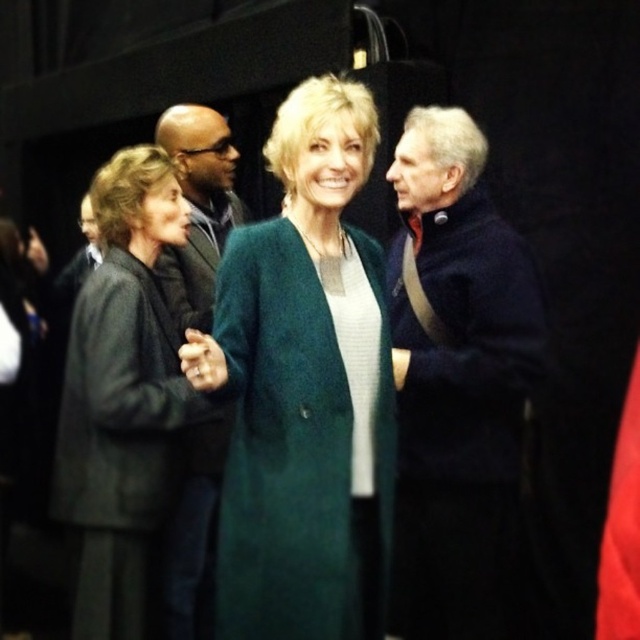
Question: Does green wool coat at center appear over matte black coat at center?

Choices:
 (A) yes
 (B) no

Answer: (B)

Question: Does dark blue sweater at right appear on the left side of dark gray wool coat at left?

Choices:
 (A) no
 (B) yes

Answer: (A)

Question: Which object is positioned farthest from the green wool coat at center?

Choices:
 (A) dark gray wool coat at left
 (B) matte black coat at center
 (C) dark blue sweater at right

Answer: (B)

Question: Where is green wool coat at center located in relation to dark blue sweater at right in the image?

Choices:
 (A) right
 (B) left

Answer: (B)

Question: Which point is closer to the camera?

Choices:
 (A) matte black coat at center
 (B) dark gray wool coat at left

Answer: (B)

Question: Which object appears closest to the camera in this image?

Choices:
 (A) dark gray wool coat at left
 (B) dark blue sweater at right

Answer: (A)